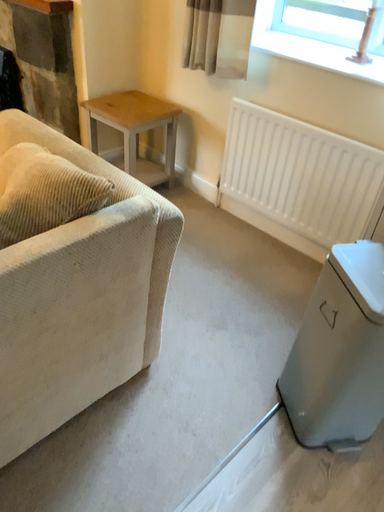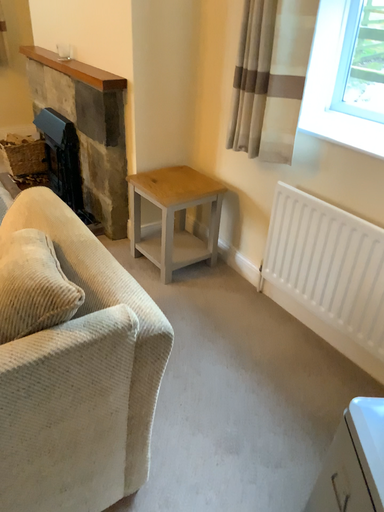
Question: How did the camera likely rotate when shooting the video?

Choices:
 (A) rotated right
 (B) rotated left

Answer: (B)